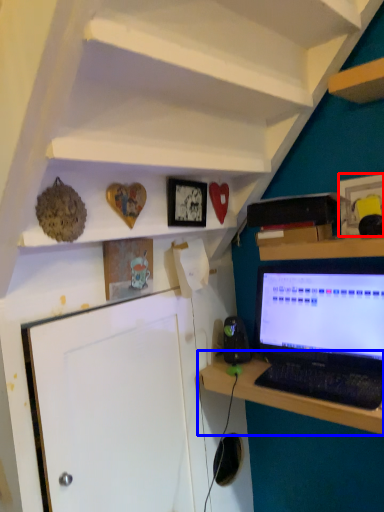
Question: Which point is further to the camera, picture frame (highlighted by a red box) or desk (highlighted by a blue box)?

Choices:
 (A) picture frame
 (B) desk

Answer: (A)